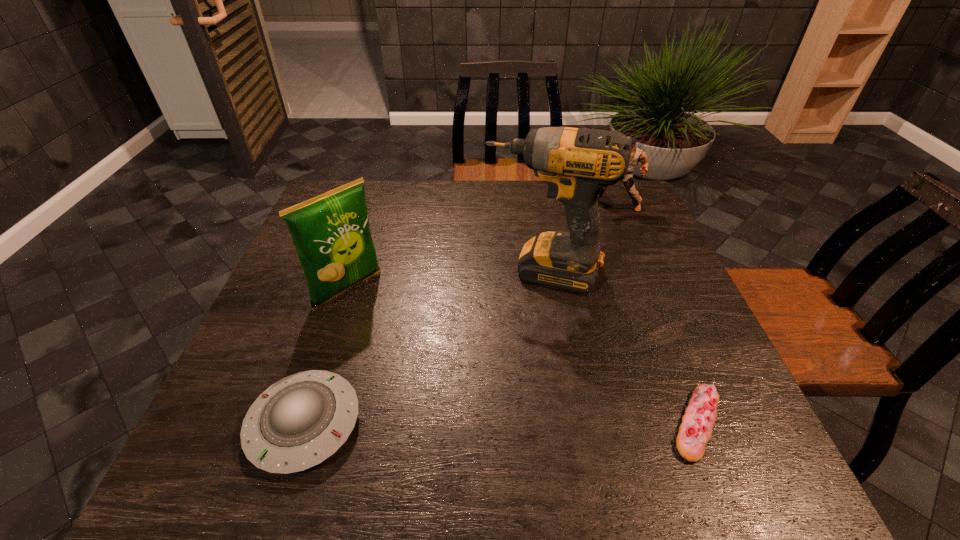
Locate an element on the screen. This screenshot has width=960, height=540. vacant space on the desktop that is between the saucer and the eclair and is positioned on the front-facing side of the crisp (potato chip) is located at coordinates (500, 423).

In order to click on vacant space on the desktop that is between the saucer and the eclair and is positioned with the drill bit of the drill facing forward in this screenshot , I will do `click(496, 423)`.

Where is `free space on the desktop that is between the second shortest object and the shortest object and is positioned on the front-facing side of the puncher`? free space on the desktop that is between the second shortest object and the shortest object and is positioned on the front-facing side of the puncher is located at coordinates (466, 423).